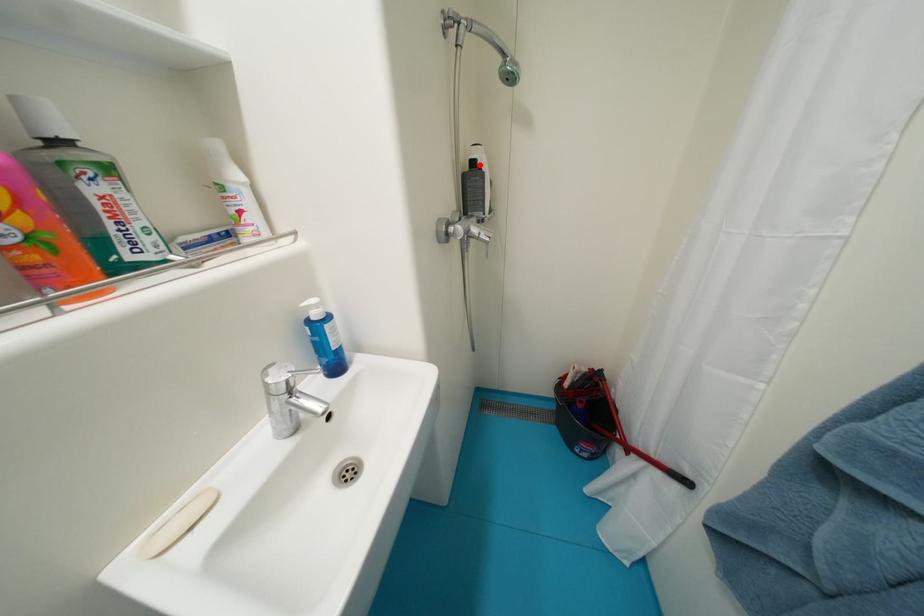
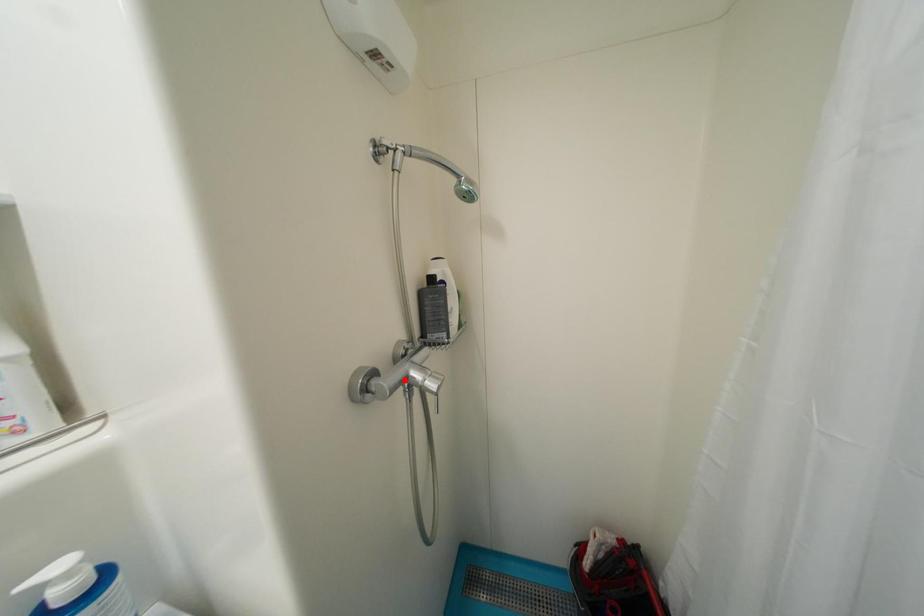
I am providing you with two images of the same scene from different viewpoints. A red point is marked on the first image and another point is marked on the second image. Are the points marked in image1 and image2 representing the same 3D position?

No